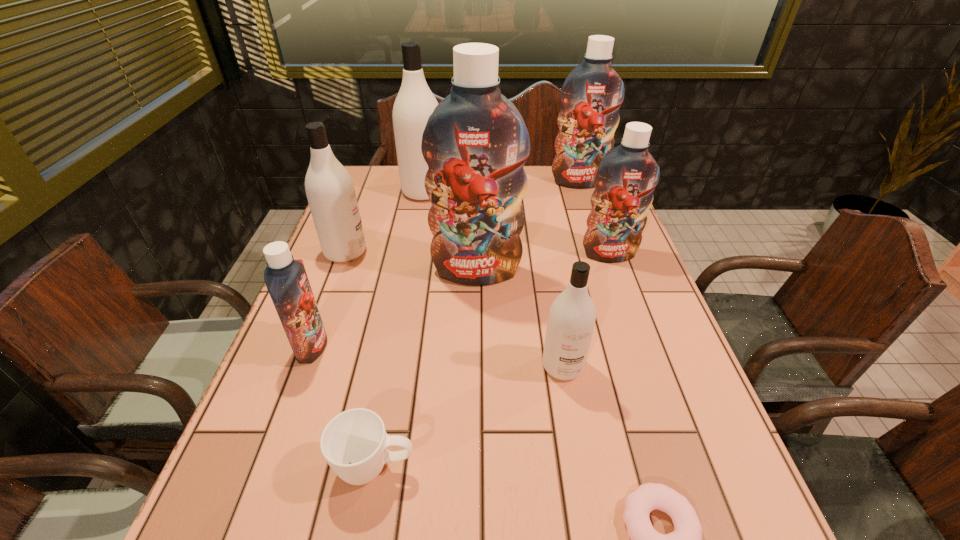
Find the location of a particular element. vacant point located between the sixth object from left to right and the farthest blue shampoo is located at coordinates (570, 274).

Find the location of a particular element. This screenshot has width=960, height=540. free space between the second farthest white shampoo and the rightmost white shampoo is located at coordinates (454, 309).

Where is `vacant point located between the third biggest blue shampoo and the smallest blue shampoo`? The height and width of the screenshot is (540, 960). vacant point located between the third biggest blue shampoo and the smallest blue shampoo is located at coordinates (461, 300).

Locate an element on the screen. empty location between the nearest blue shampoo and the second smallest blue shampoo is located at coordinates (461, 300).

The image size is (960, 540). Identify the location of vacant space in between the tallest shampoo and the second biggest blue shampoo. (528, 226).

Identify which object is located as the eighth nearest to the smallest blue shampoo. Please provide its 2D coordinates. Your answer should be formatted as a tuple, i.e. [(x, y)], where the tuple contains the x and y coordinates of a point satisfying the conditions above.

[(591, 96)]

Identify the location of object that is the fifth closest to the second farthest white shampoo. The height and width of the screenshot is (540, 960). (572, 315).

In order to click on shampoo that is the closest to the second smallest blue shampoo in this screenshot , I will do `click(475, 142)`.

Locate an element on the screen. This screenshot has height=540, width=960. shampoo that is the closest to the shortest object is located at coordinates (572, 315).

Identify the location of blue shampoo that stands as the third closest to the third biggest blue shampoo. Image resolution: width=960 pixels, height=540 pixels. (286, 279).